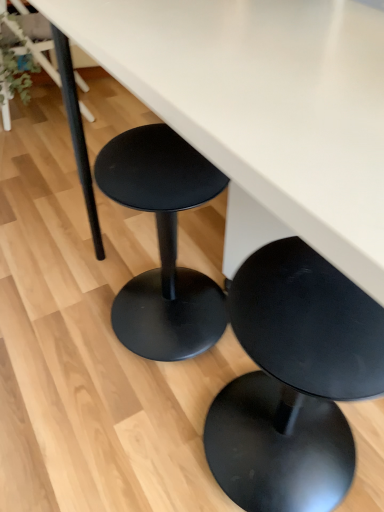
Question: Can you confirm if matte black stool at lower center is bigger than matte black stool at upper left?

Choices:
 (A) no
 (B) yes

Answer: (A)

Question: Is matte black stool at lower center touching matte black stool at upper left?

Choices:
 (A) no
 (B) yes

Answer: (A)

Question: Can you confirm if matte black stool at lower center is smaller than matte black stool at upper left?

Choices:
 (A) no
 (B) yes

Answer: (B)

Question: Does matte black stool at lower center have a lesser width compared to matte black stool at upper left?

Choices:
 (A) no
 (B) yes

Answer: (B)

Question: Is matte black stool at lower center closer to camera compared to matte black stool at upper left?

Choices:
 (A) no
 (B) yes

Answer: (B)

Question: Considering the relative positions of matte black stool at lower center and matte black stool at upper left in the image provided, is matte black stool at lower center to the right of matte black stool at upper left from the viewer's perspective?

Choices:
 (A) yes
 (B) no

Answer: (A)

Question: From a real-world perspective, is green matte plant at upper left on matte black stool at lower center?

Choices:
 (A) no
 (B) yes

Answer: (B)

Question: Is green matte plant at upper left smaller than matte black stool at lower center?

Choices:
 (A) yes
 (B) no

Answer: (A)

Question: Is matte black stool at lower center surrounded by green matte plant at upper left?

Choices:
 (A) yes
 (B) no

Answer: (B)

Question: Can you confirm if green matte plant at upper left is positioned to the left of matte black stool at lower center?

Choices:
 (A) yes
 (B) no

Answer: (A)

Question: Is green matte plant at upper left further to camera compared to matte black stool at lower center?

Choices:
 (A) yes
 (B) no

Answer: (A)

Question: Is green matte plant at upper left in front of matte black stool at lower center?

Choices:
 (A) no
 (B) yes

Answer: (A)

Question: Is matte black stool at lower center taller than green matte plant at upper left?

Choices:
 (A) yes
 (B) no

Answer: (A)